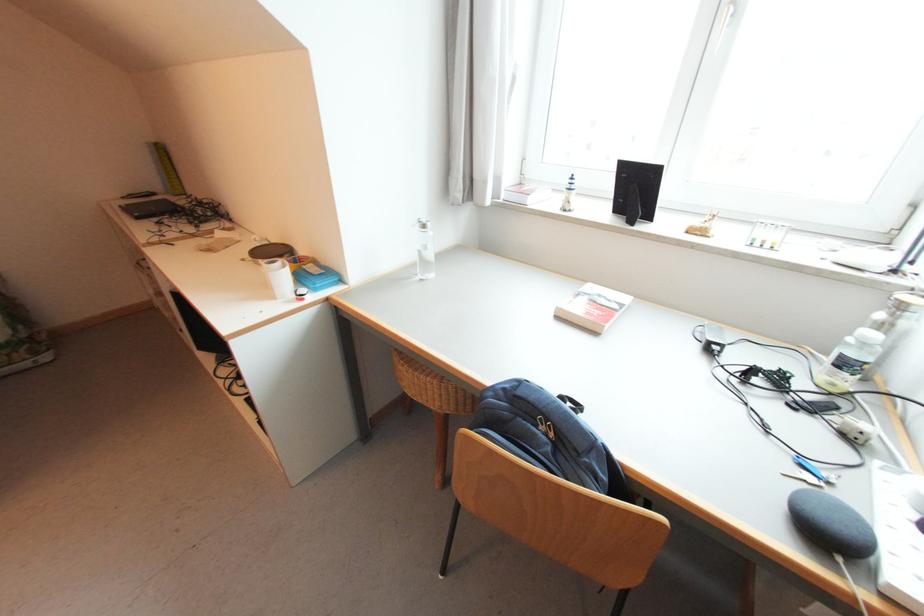
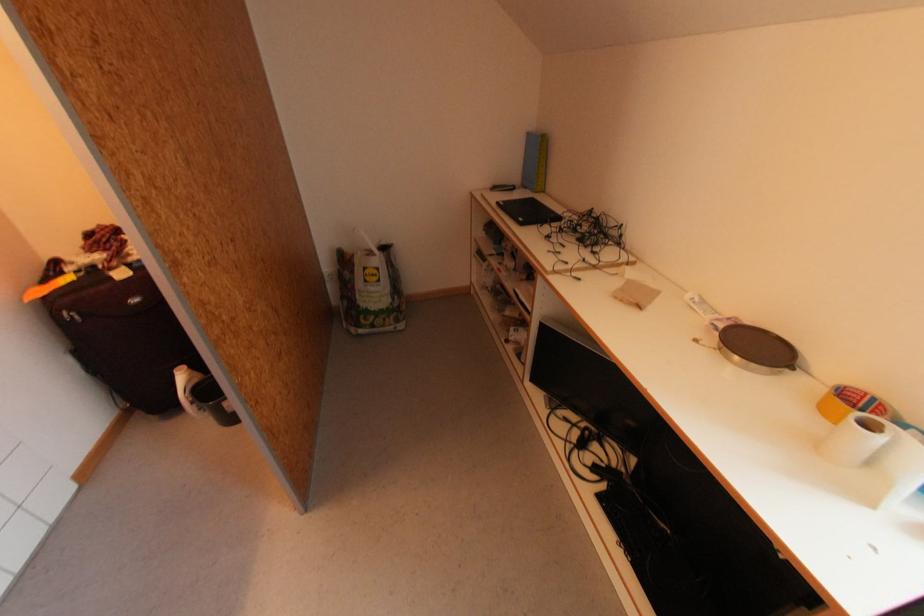
Find the pixel in the second image that matches (127,208) in the first image.

(503, 205)